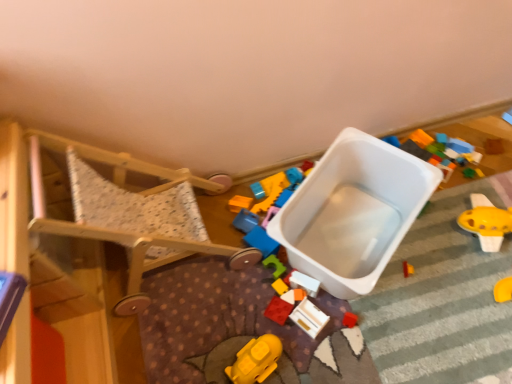
Find the location of a particular element. This screenshot has height=384, width=512. free space behind wooden toy at center, the second toy in the right-to-left sequence is located at coordinates (308, 256).